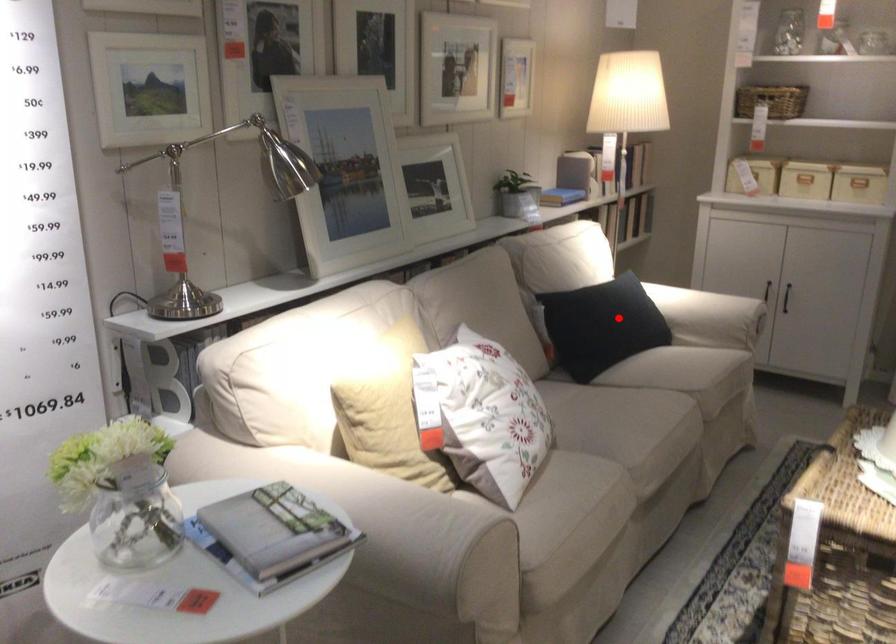
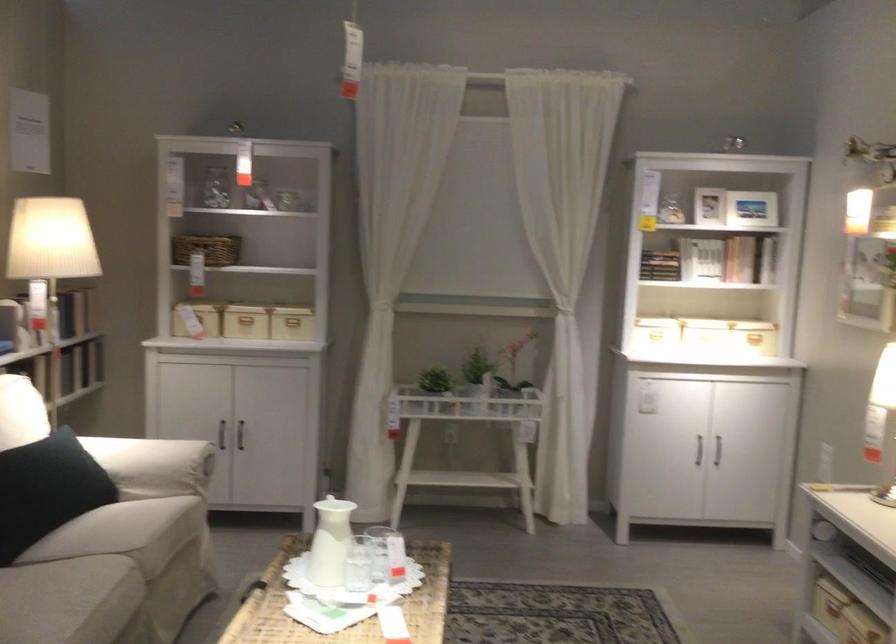
Question: A red point is marked in image1. In image2, is the corresponding 3D point closer to the camera or farther? Reply with the corresponding letter.

Choices:
 (A) The corresponding 3D point is closer.
 (B) The corresponding 3D point is farther.

Answer: (A)